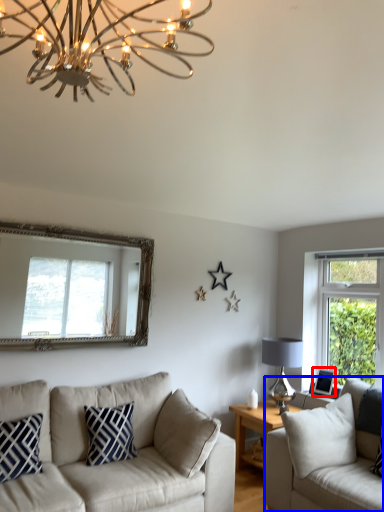
Question: Among these objects, which one is nearest to the camera, picture frame (highlighted by a red box) or studio couch (highlighted by a blue box)?

Choices:
 (A) picture frame
 (B) studio couch

Answer: (B)